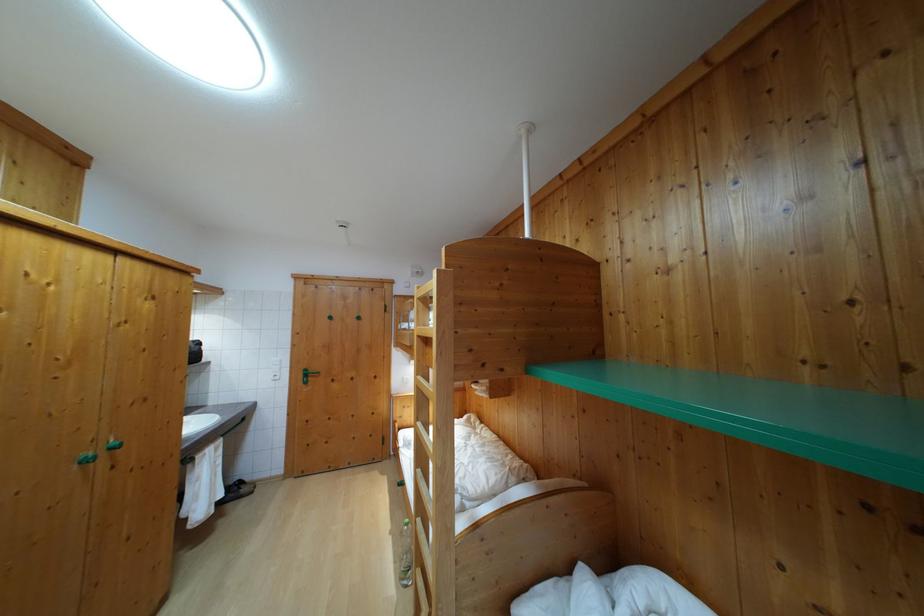
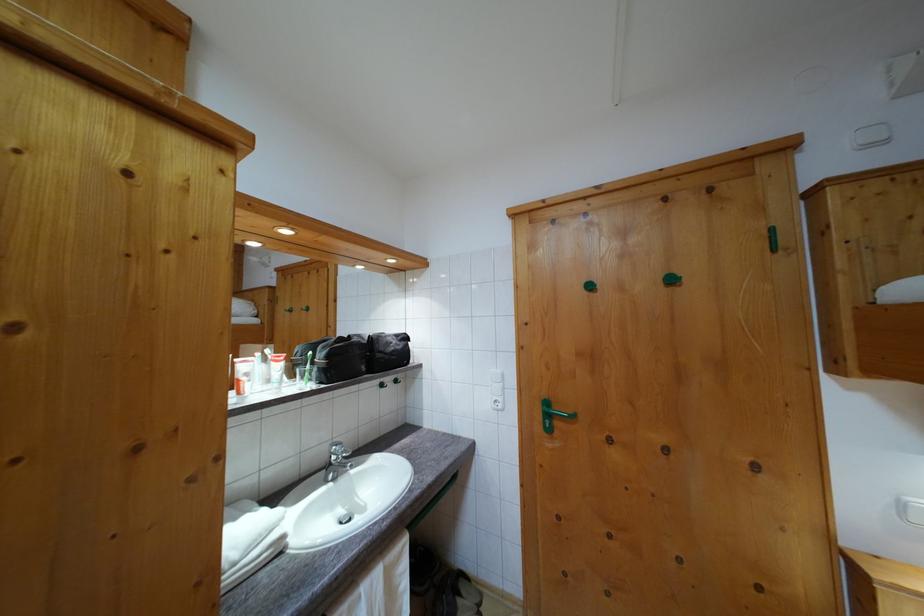
The point at (x=310, y=377) is marked in the first image. Where is the corresponding point in the second image?

(551, 410)